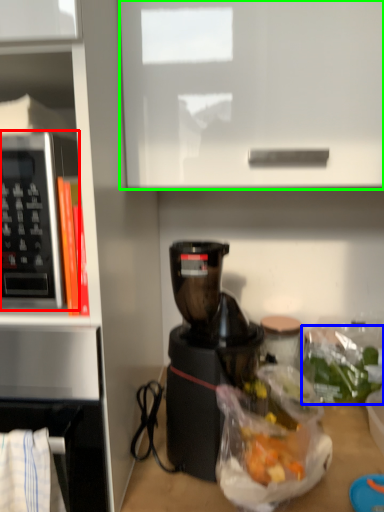
Question: Which is nearer to the microwave oven (highlighted by a red box)? food (highlighted by a blue box) or cabinetry (highlighted by a green box).

Choices:
 (A) food
 (B) cabinetry

Answer: (B)